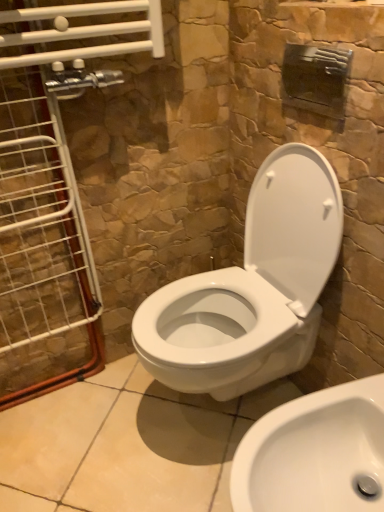
This screenshot has width=384, height=512. Identify the location of clear glass door at left. (51, 179).

You are a GUI agent. You are given a task and a screenshot of the screen. Output one action in this format:
    pyautogui.click(x=<x>, y=<y>)
    Task: Click on the clear glass door at left
    
    Given the screenshot: What is the action you would take?
    pyautogui.click(x=51, y=179)

Is white glossy toilet at center further to the viewer compared to clear glass door at left?

No, it is not.

In the image, there is a clear glass door at left. What are the coordinates of `toilet below it (from a real-world perspective)` in the screenshot? It's located at (252, 288).

Considering the relative positions of white glossy toilet at center and clear glass door at left in the image provided, is white glossy toilet at center to the right of clear glass door at left from the viewer's perspective?

Yes.

Is white glossy toilet at center positioned with its back to clear glass door at left?

No, clear glass door at left is not at the back of white glossy toilet at center.

From a real-world perspective, is clear glass door at left on top of white glossy toilet at center?

Yes, from a real-world perspective, clear glass door at left is above white glossy toilet at center.

Who is smaller, clear glass door at left or white glossy toilet at center?

With smaller size is clear glass door at left.

Does point (34, 234) come behind point (253, 317)?

That is True.

From their relative heights in the image, would you say clear glass door at left is taller or shorter than white glossy toilet at center?

Clearly, clear glass door at left is taller compared to white glossy toilet at center.

Is point (338, 499) closer to viewer compared to point (259, 328)?

Yes.

Does white glossy sink at lower right turn towards white glossy toilet at center?

No, white glossy sink at lower right is not oriented towards white glossy toilet at center.

Which object is wider, white glossy sink at lower right or white glossy toilet at center?

Wider between the two is white glossy sink at lower right.

Which point is more distant from viewer, (7, 281) or (289, 406)?

The point (7, 281) is farther.

Does clear glass door at left have a smaller size compared to white glossy sink at lower right?

Yes.

From the image's perspective, between clear glass door at left and white glossy sink at lower right, which one is located above?

clear glass door at left.

Is clear glass door at left facing towards white glossy sink at lower right?

No, clear glass door at left is not oriented towards white glossy sink at lower right.

From the image's perspective, is white glossy toilet at center located above white glossy sink at lower right?

Yes, from the image's perspective, white glossy toilet at center is on top of white glossy sink at lower right.

Relative to white glossy sink at lower right, is white glossy toilet at center in front or behind?

Visually, white glossy toilet at center is located behind white glossy sink at lower right.

Locate an element on the screen. sink in front of the white glossy toilet at center is located at coordinates (314, 452).

Considering the relative sizes of white glossy sink at lower right and clear glass door at left in the image provided, is white glossy sink at lower right taller than clear glass door at left?

In fact, white glossy sink at lower right may be shorter than clear glass door at left.

Which object is positioned more to the left, white glossy sink at lower right or clear glass door at left?

clear glass door at left is more to the left.

Are white glossy sink at lower right and clear glass door at left far apart?

Actually, white glossy sink at lower right and clear glass door at left are a little close together.

At what (x,y) coordinates should I click in order to perform the action: click on sink on the right of clear glass door at left. Please return your answer as a coordinate pair (x, y). Image resolution: width=384 pixels, height=512 pixels. Looking at the image, I should click on (314, 452).

Find the location of a particular element. The image size is (384, 512). glass door above the white glossy toilet at center (from the image's perspective) is located at coordinates (51, 179).

Where is `toilet lying below the clear glass door at left (from the image's perspective)`? toilet lying below the clear glass door at left (from the image's perspective) is located at coordinates (252, 288).

When comparing their distances from clear glass door at left, does white glossy sink at lower right or white glossy toilet at center seem further?

Among the two, white glossy sink at lower right is located further to clear glass door at left.

Which object lies further to the anchor point white glossy sink at lower right, white glossy toilet at center or clear glass door at left?

clear glass door at left.

Looking at the image, which one is located closer to white glossy toilet at center, white glossy sink at lower right or clear glass door at left?

white glossy sink at lower right lies closer to white glossy toilet at center than the other object.

Considering their positions, is clear glass door at left positioned closer to white glossy toilet at center than white glossy sink at lower right?

Based on the image, white glossy sink at lower right appears to be nearer to white glossy toilet at center.

Which object lies further to the anchor point clear glass door at left, white glossy toilet at center or white glossy sink at lower right?

white glossy sink at lower right is positioned further to the anchor clear glass door at left.

Looking at the image, which one is located further to white glossy sink at lower right, clear glass door at left or white glossy toilet at center?

Based on the image, clear glass door at left appears to be further to white glossy sink at lower right.

What are the coordinates of `toilet between clear glass door at left and white glossy sink at lower right` in the screenshot? It's located at [x=252, y=288].